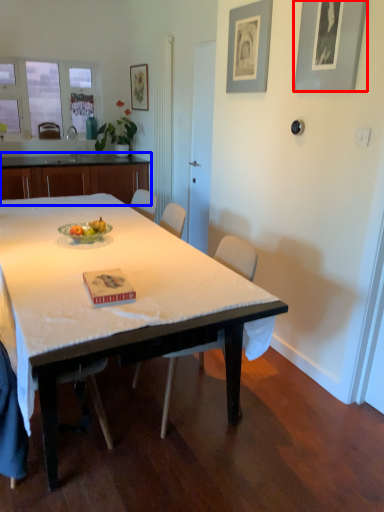
Question: Which object appears farthest to the camera in this image, picture frame (highlighted by a red box) or cabinetry (highlighted by a blue box)?

Choices:
 (A) picture frame
 (B) cabinetry

Answer: (B)